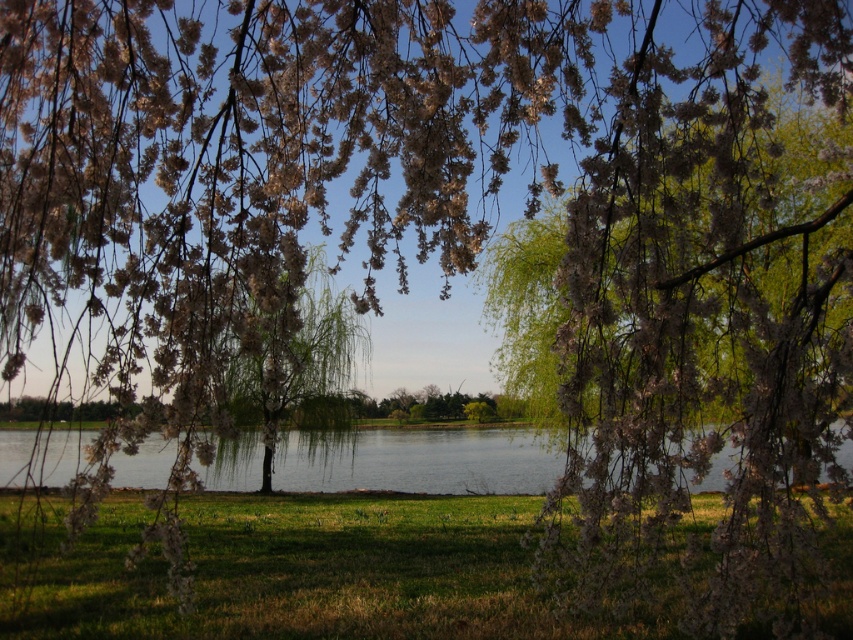
Question: From the image, what is the correct spatial relationship of clear water at center in relation to green leafy willow at center?

Choices:
 (A) above
 (B) below

Answer: (B)

Question: Among these points, which one is nearest to the camera?

Choices:
 (A) (245, 356)
 (B) (155, 552)

Answer: (A)

Question: Which point is closer to the camera taking this photo?

Choices:
 (A) (321, 301)
 (B) (540, 481)

Answer: (B)

Question: Estimate the real-world distances between objects in this image. Which object is farther from the clear water at center?

Choices:
 (A) green leafy willow at center
 (B) green grass at lower center

Answer: (A)

Question: Does green grass at lower center have a greater width compared to green leafy willow at center?

Choices:
 (A) no
 (B) yes

Answer: (B)

Question: Is clear water at center bigger than green leafy willow at center?

Choices:
 (A) no
 (B) yes

Answer: (B)